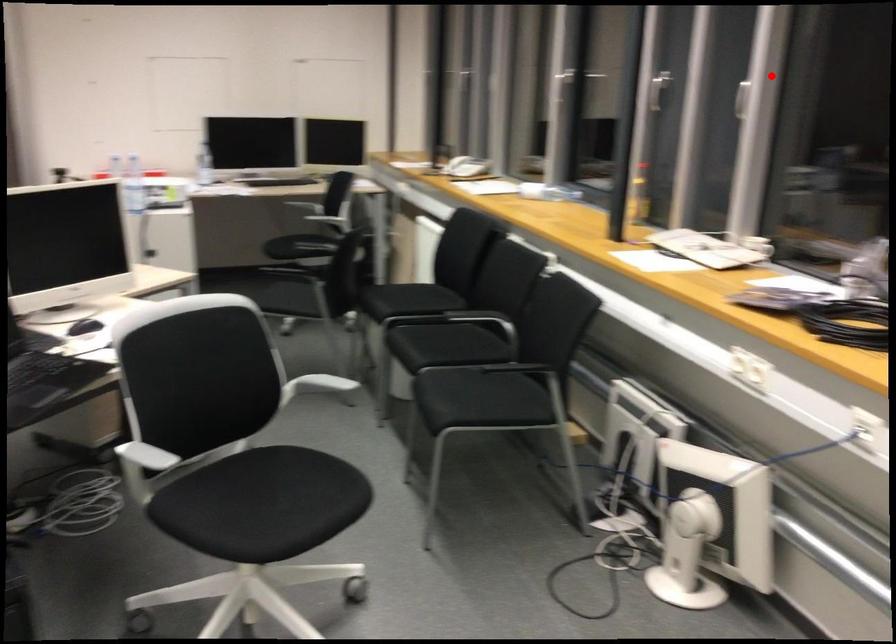
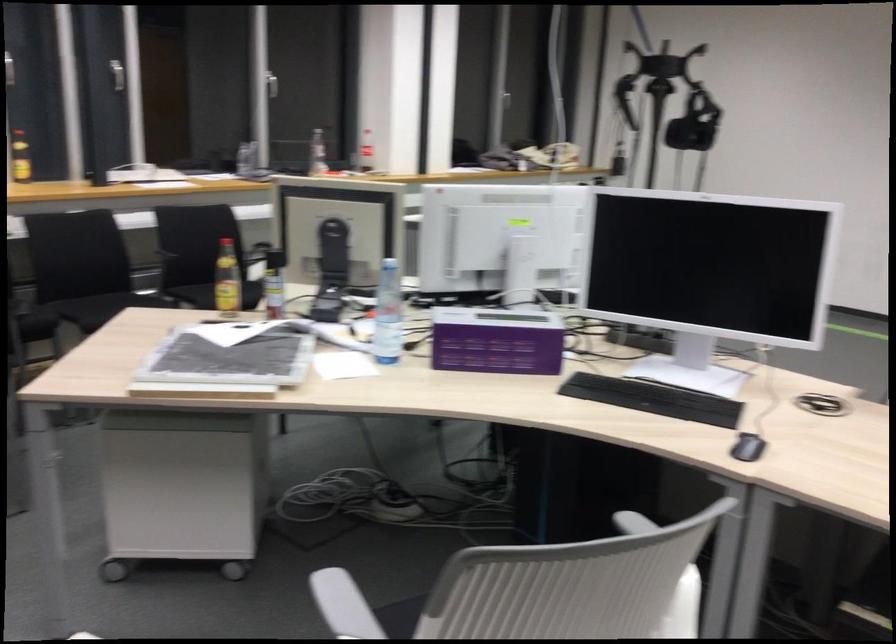
Question: I am providing you with two images of the same scene from different viewpoints. A red point is shown in image1. For the corresponding object point in image2, is it positioned nearer or farther from the camera?

Choices:
 (A) Nearer
 (B) Farther

Answer: (B)